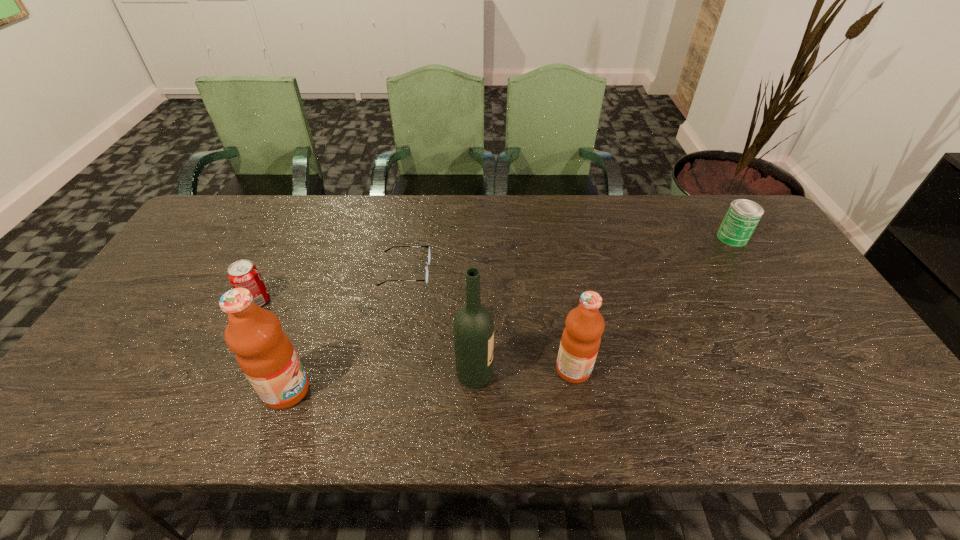
Where is `object at the far right corner`? Image resolution: width=960 pixels, height=540 pixels. object at the far right corner is located at coordinates (742, 216).

The width and height of the screenshot is (960, 540). Identify the location of free space at the far edge of the desktop. (521, 233).

The height and width of the screenshot is (540, 960). Identify the location of free spot at the near edge of the desktop. (780, 377).

In the image, there is a desktop. Where is `free space at the left edge`? The width and height of the screenshot is (960, 540). free space at the left edge is located at coordinates (187, 323).

The height and width of the screenshot is (540, 960). I want to click on vacant space at the right edge, so click(839, 330).

Locate an element on the screen. This screenshot has height=540, width=960. free location at the far left corner is located at coordinates (221, 235).

In the image, there is a desktop. Where is `vacant space at the near left corner`? Image resolution: width=960 pixels, height=540 pixels. vacant space at the near left corner is located at coordinates (143, 368).

This screenshot has width=960, height=540. I want to click on blank region between the taller fruit juice and the fourth object from left to right, so pos(380,383).

This screenshot has height=540, width=960. What are the coordinates of `vacant area that lies between the second farthest object and the rightmost object` in the screenshot? It's located at (569, 254).

Locate an element on the screen. The height and width of the screenshot is (540, 960). vacant area that lies between the wine bottle and the fourth nearest object is located at coordinates (366, 338).